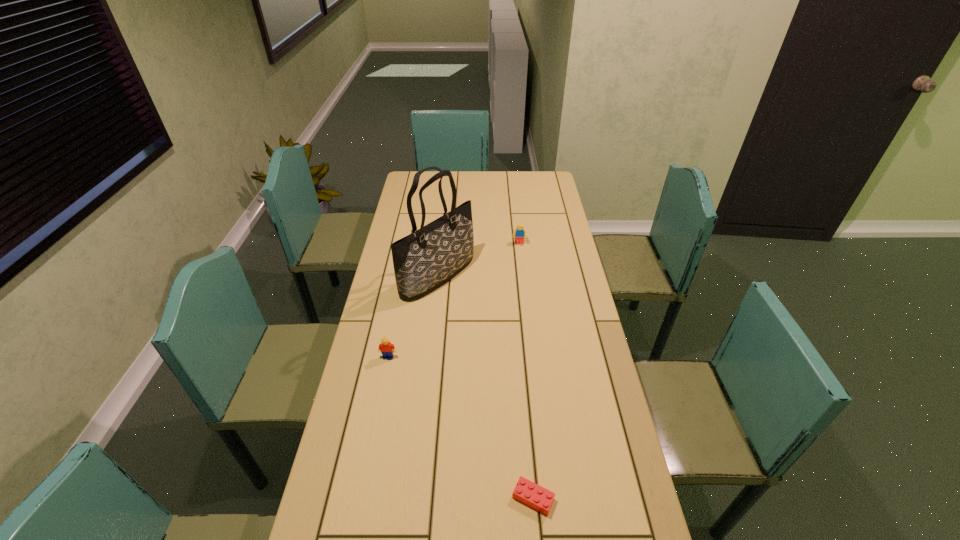
At what (x,y) coordinates should I click in order to perform the action: click on vacant space located on the right of the nearest Lego. Please return your answer as a coordinate pair (x, y). Looking at the image, I should click on (595, 498).

Find the location of a particular element. Image resolution: width=960 pixels, height=540 pixels. tote bag that is at the left edge is located at coordinates 429,257.

Locate an element on the screen. The height and width of the screenshot is (540, 960). Lego located in the left edge section of the desktop is located at coordinates (387, 349).

In the image, there is a desktop. Where is `vacant region at the far edge`? The image size is (960, 540). vacant region at the far edge is located at coordinates (449, 191).

What are the coordinates of `vacant area at the left edge of the desktop` in the screenshot? It's located at (406, 334).

In the image, there is a desktop. Where is `vacant space at the right edge`? This screenshot has width=960, height=540. vacant space at the right edge is located at coordinates (543, 218).

The height and width of the screenshot is (540, 960). Identify the location of vacant space at the far left corner of the desktop. (420, 184).

Find the location of a particular element. The width and height of the screenshot is (960, 540). unoccupied position between the shortest Lego and the leftmost Lego is located at coordinates (461, 428).

The image size is (960, 540). Find the location of `free spot between the second farthest object and the shortest object`. free spot between the second farthest object and the shortest object is located at coordinates (486, 387).

In order to click on unoccupied area between the second farthest Lego and the third nearest object in this screenshot , I will do `click(413, 316)`.